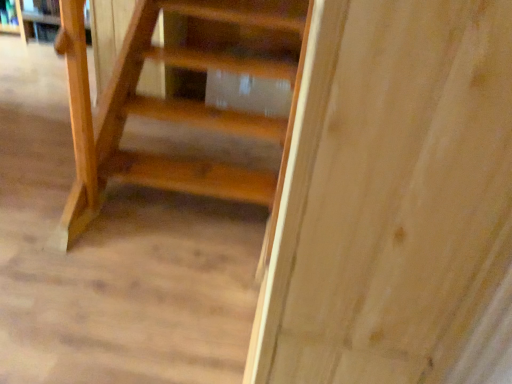
Question: Do you think matte wooden book at upper left is within wooden shelf at upper left, or outside of it?

Choices:
 (A) outside
 (B) inside

Answer: (B)

Question: Based on their sizes in the image, would you say matte wooden book at upper left is bigger or smaller than wooden shelf at upper left?

Choices:
 (A) small
 (B) big

Answer: (A)

Question: Does point (35, 1) appear closer or farther from the camera than point (22, 23)?

Choices:
 (A) closer
 (B) farther

Answer: (A)

Question: Is wooden shelf at upper left bigger or smaller than matte wooden book at upper left?

Choices:
 (A) small
 (B) big

Answer: (B)

Question: From a real-world perspective, relative to matte wooden book at upper left, is wooden shelf at upper left vertically above or below?

Choices:
 (A) above
 (B) below

Answer: (B)

Question: Is wooden shelf at upper left to the left or to the right of matte wooden book at upper left in the image?

Choices:
 (A) right
 (B) left

Answer: (A)

Question: Considering the positions of wooden shelf at upper left and matte wooden book at upper left in the image, is wooden shelf at upper left wider or thinner than matte wooden book at upper left?

Choices:
 (A) wide
 (B) thin

Answer: (A)